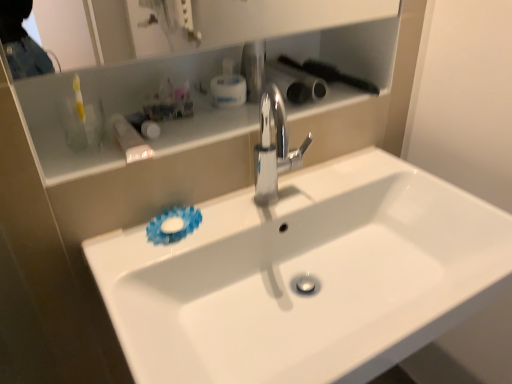
This screenshot has height=384, width=512. What are the coordinates of `vacant space to the right of polished chrome faucet at center` in the screenshot? It's located at (340, 182).